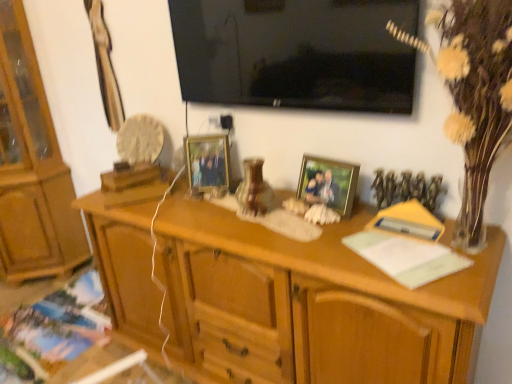
Locate an element on the screen. vacant space that's between white paper at right, placed as the 2th book when sorted from right to left, and white textured vase at right is located at coordinates (430, 278).